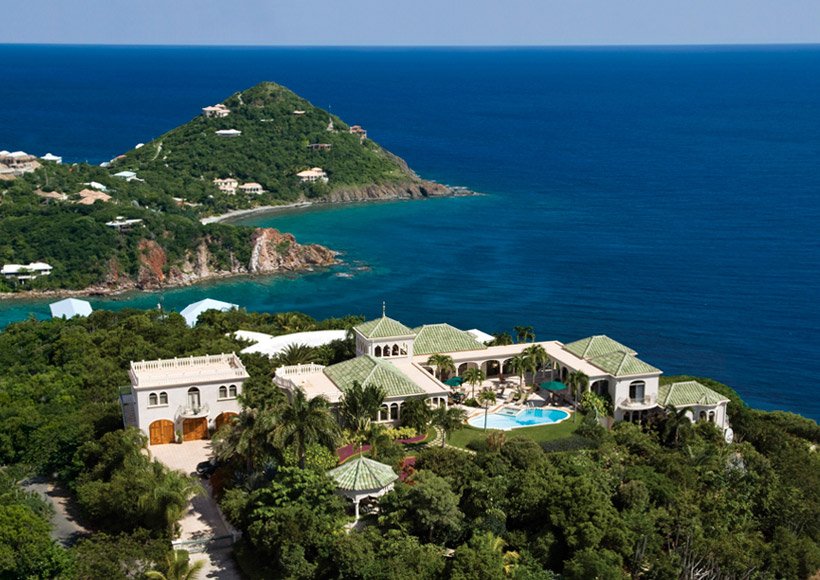
What are the coordinates of `wooden doors` in the screenshot? It's located at (153, 429), (167, 425), (190, 429), (198, 427), (221, 420), (229, 418).